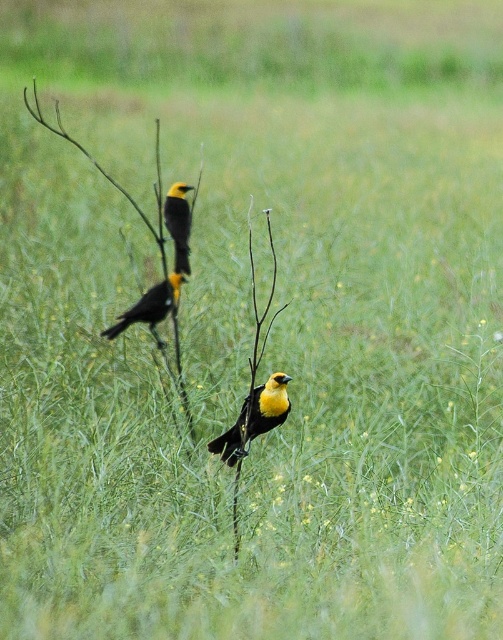
Who is lower down, yellow-feathered bird at center or yellow matte/black bird at upper center?

yellow-feathered bird at center is lower down.

Does point (163, 312) come in front of point (186, 237)?

Yes, point (163, 312) is in front of point (186, 237).

Where is `yellow-feathered bird at center`? The height and width of the screenshot is (640, 503). yellow-feathered bird at center is located at coordinates (149, 307).

The image size is (503, 640). What are the coordinates of `yellow-feathered bird at center` in the screenshot? It's located at (149, 307).

Locate an element on the screen. yellow matte bird at center is located at coordinates (269, 404).

Between point (266, 396) and point (189, 228), which one is positioned behind?

The point (189, 228) is behind.

Between point (221, 440) and point (176, 232), which one is positioned behind?

Positioned behind is point (176, 232).

You are a GUI agent. You are given a task and a screenshot of the screen. Output one action in this format:
    pyautogui.click(x=<x>, y=<y>)
    Task: Click on the yellow matte bird at center
    
    Given the screenshot: What is the action you would take?
    pyautogui.click(x=269, y=404)

Does yellow matte bird at center have a smaller size compared to yellow-feathered bird at center?

Indeed, yellow matte bird at center has a smaller size compared to yellow-feathered bird at center.

Which is in front, point (227, 460) or point (161, 312)?

Point (227, 460)

This screenshot has height=640, width=503. I want to click on yellow matte bird at center, so click(269, 404).